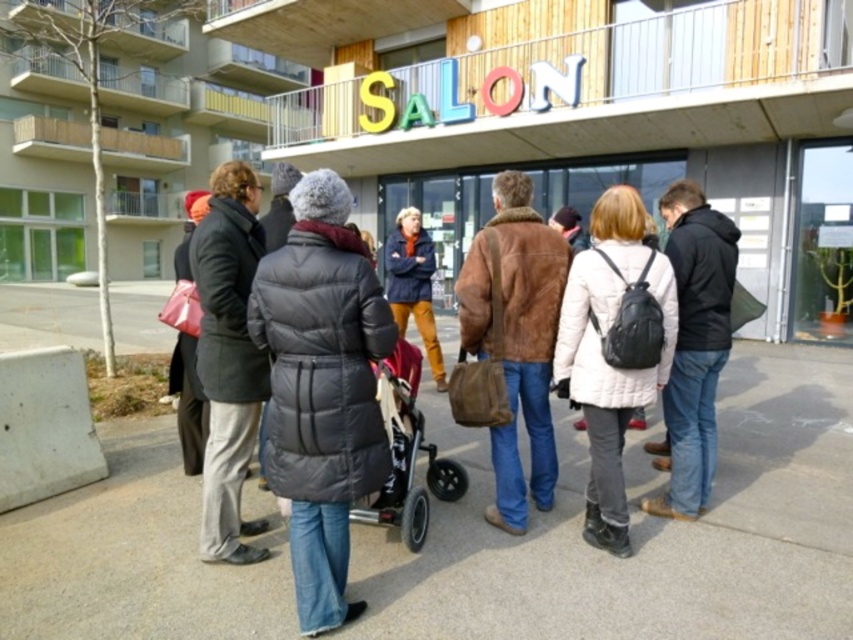
Does matte black puffer jacket at center appear on the left side of black leather jacket at center?

Correct, you'll find matte black puffer jacket at center to the left of black leather jacket at center.

You are a GUI agent. You are given a task and a screenshot of the screen. Output one action in this format:
    pyautogui.click(x=<x>, y=<y>)
    Task: Click on the matte black puffer jacket at center
    The height and width of the screenshot is (640, 853).
    Given the screenshot: What is the action you would take?
    pyautogui.click(x=321, y=388)

Who is shorter, white puffer jacket at center or black leather jacket at center?

white puffer jacket at center

Is point (575, 304) closer to viewer compared to point (695, 368)?

Yes.

Who is more distant from viewer, (585,490) or (676,424)?

The point (676,424) is more distant.

What are the coordinates of `white puffer jacket at center` in the screenshot? It's located at (614, 348).

Who is more forward, (x=271, y=548) or (x=332, y=193)?

Positioned in front is point (x=332, y=193).

Between gray asphalt pavement at center and matte black puffer jacket at center, which one has more height?

matte black puffer jacket at center is taller.

What are the coordinates of `gray asphalt pavement at center` in the screenshot? It's located at (646, 531).